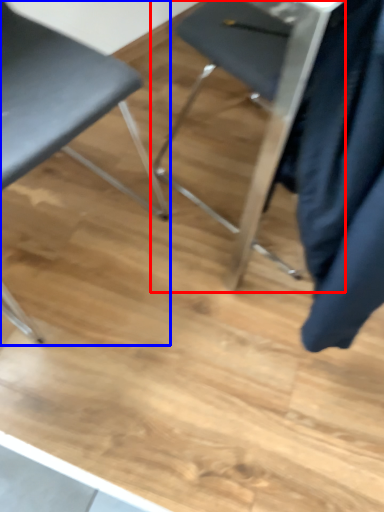
Question: Which of the following is the closest to the observer, chair (highlighted by a red box) or chair (highlighted by a blue box)?

Choices:
 (A) chair
 (B) chair

Answer: (B)